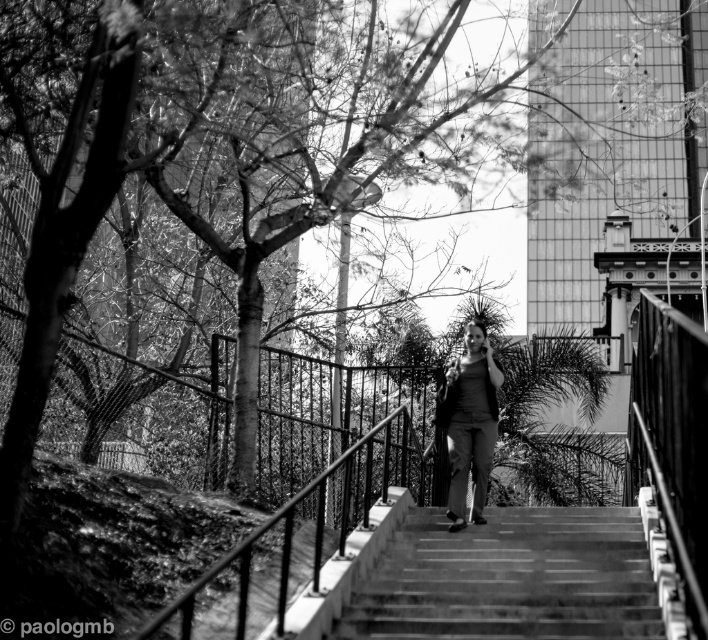
Does smooth concrete stairs at center appear on the right side of matte gray pants at center?

Correct, you'll find smooth concrete stairs at center to the right of matte gray pants at center.

Can you confirm if smooth concrete stairs at center is thinner than matte gray pants at center?

No, smooth concrete stairs at center is not thinner than matte gray pants at center.

I want to click on smooth concrete stairs at center, so click(x=510, y=579).

Measure the distance between smooth metal railing at center and matte gray pants at center.

smooth metal railing at center and matte gray pants at center are 7.82 meters apart from each other.

Who is more forward, (360, 456) or (462, 440)?

Point (462, 440) is in front.

Is point (371, 493) positioned in front of point (481, 476)?

No, it is not.

Locate an element on the screen. Image resolution: width=708 pixels, height=640 pixels. smooth metal railing at center is located at coordinates (297, 540).

Describe the element at coordinates (510, 579) in the screenshot. I see `smooth concrete stairs at center` at that location.

Is point (468, 627) positioned behind point (190, 609)?

That is True.

Who is more forward, (532,516) or (372,472)?

Point (532,516) is in front.

The width and height of the screenshot is (708, 640). Identify the location of smooth concrete stairs at center. (510, 579).